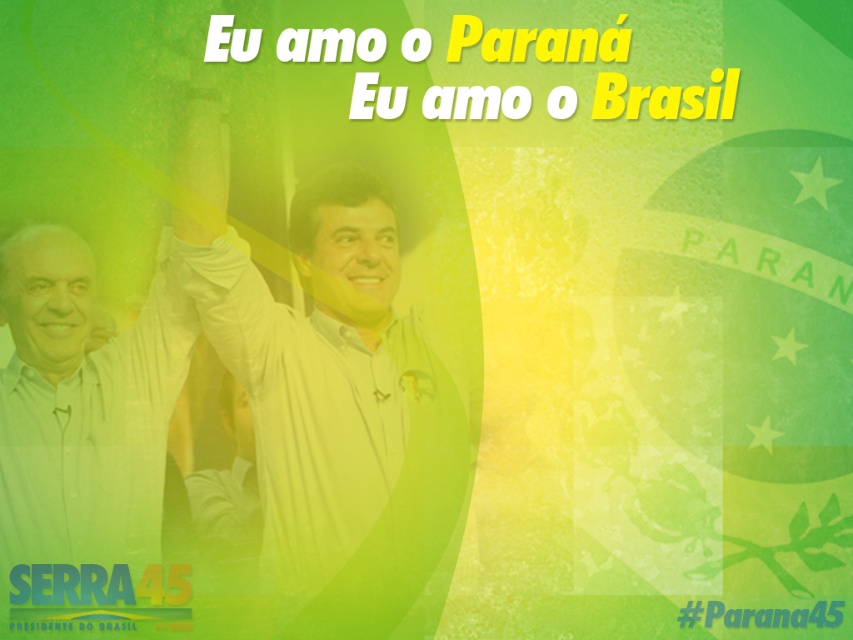
You are standing in front of the political campaign poster described. You notice a point marked at coordinates [332,401]. What object is located at this point?

The point at [332,401] corresponds to the white shirt at center.